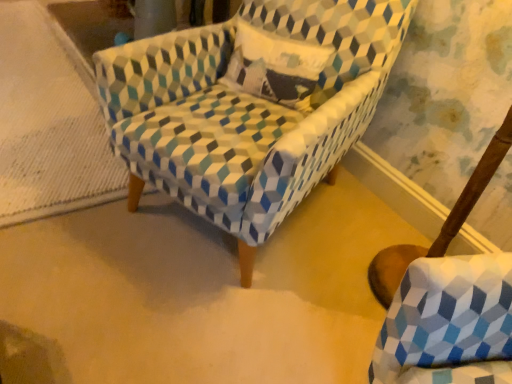
Question: Is textured cotton pillow at center oriented away from textured fabric swivel chair at lower right?

Choices:
 (A) no
 (B) yes

Answer: (A)

Question: Would you consider textured cotton pillow at center to be distant from textured fabric swivel chair at lower right?

Choices:
 (A) no
 (B) yes

Answer: (A)

Question: From a real-world perspective, does textured cotton pillow at center stand above textured fabric swivel chair at lower right?

Choices:
 (A) no
 (B) yes

Answer: (B)

Question: Could you tell me if textured cotton pillow at center is turned towards textured fabric swivel chair at lower right?

Choices:
 (A) no
 (B) yes

Answer: (A)

Question: Does textured cotton pillow at center have a smaller size compared to textured fabric swivel chair at lower right?

Choices:
 (A) yes
 (B) no

Answer: (B)

Question: Considering the positions of textured cotton pillow at center and textured fabric armchair at center in the image, is textured cotton pillow at center taller or shorter than textured fabric armchair at center?

Choices:
 (A) short
 (B) tall

Answer: (A)

Question: Visually, is textured cotton pillow at center positioned to the left or to the right of textured fabric armchair at center?

Choices:
 (A) right
 (B) left

Answer: (A)

Question: From the image's perspective, is textured cotton pillow at center positioned above or below textured fabric armchair at center?

Choices:
 (A) above
 (B) below

Answer: (A)

Question: Is textured cotton pillow at center bigger or smaller than textured fabric armchair at center?

Choices:
 (A) small
 (B) big

Answer: (A)

Question: Is textured fabric swivel chair at lower right taller or shorter than textured fabric armchair at center?

Choices:
 (A) tall
 (B) short

Answer: (B)

Question: From the image's perspective, is textured fabric swivel chair at lower right positioned above or below textured fabric armchair at center?

Choices:
 (A) above
 (B) below

Answer: (B)

Question: Is textured fabric swivel chair at lower right situated inside textured fabric armchair at center or outside?

Choices:
 (A) inside
 (B) outside

Answer: (B)

Question: Is point (403, 269) positioned closer to the camera than point (311, 165)?

Choices:
 (A) closer
 (B) farther

Answer: (B)

Question: Considering the positions of textured fabric armchair at center and textured fabric swivel chair at lower right in the image, is textured fabric armchair at center bigger or smaller than textured fabric swivel chair at lower right?

Choices:
 (A) small
 (B) big

Answer: (B)

Question: Is textured fabric armchair at center inside the boundaries of textured fabric swivel chair at lower right, or outside?

Choices:
 (A) inside
 (B) outside

Answer: (B)